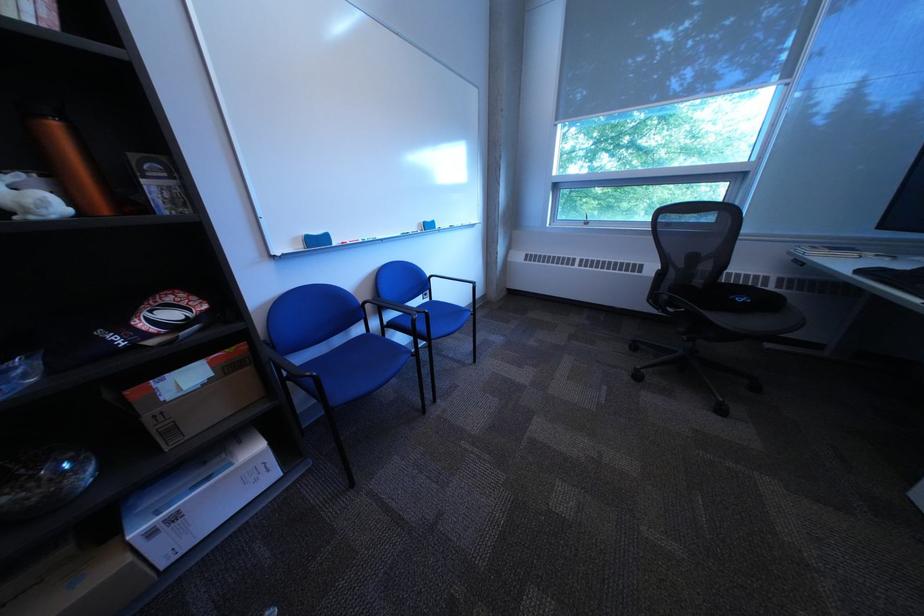
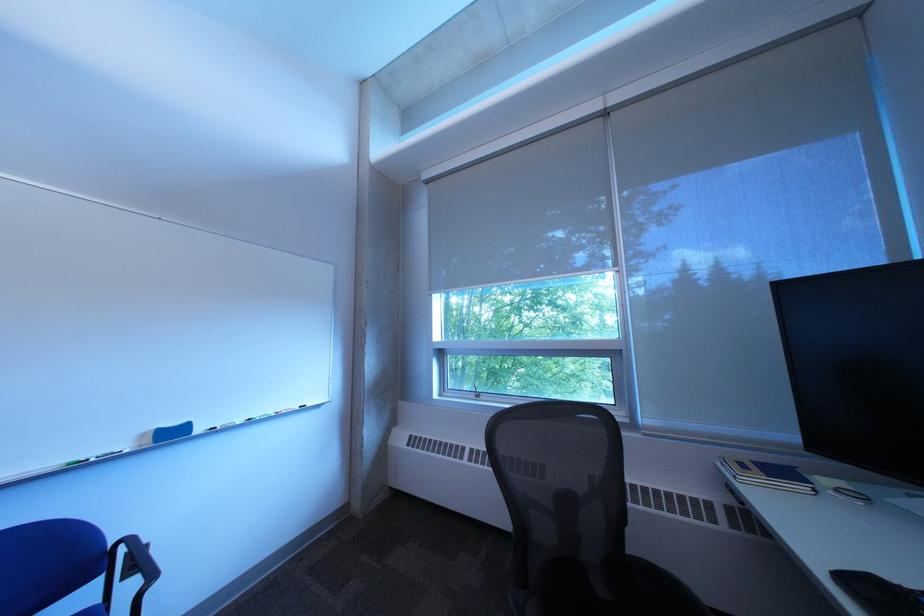
Where in the second image is the point corresponding to (x=805, y=254) from the first image?

(733, 468)